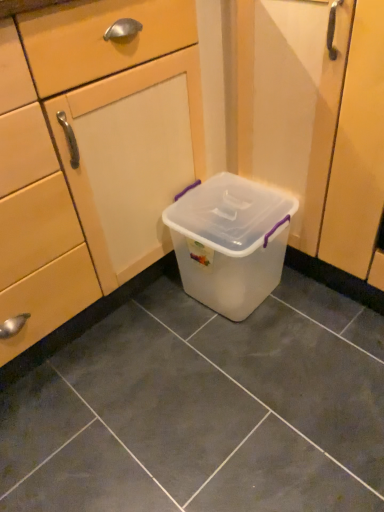
The width and height of the screenshot is (384, 512). I want to click on free space in front of transparent plastic storage box at center, so click(x=252, y=365).